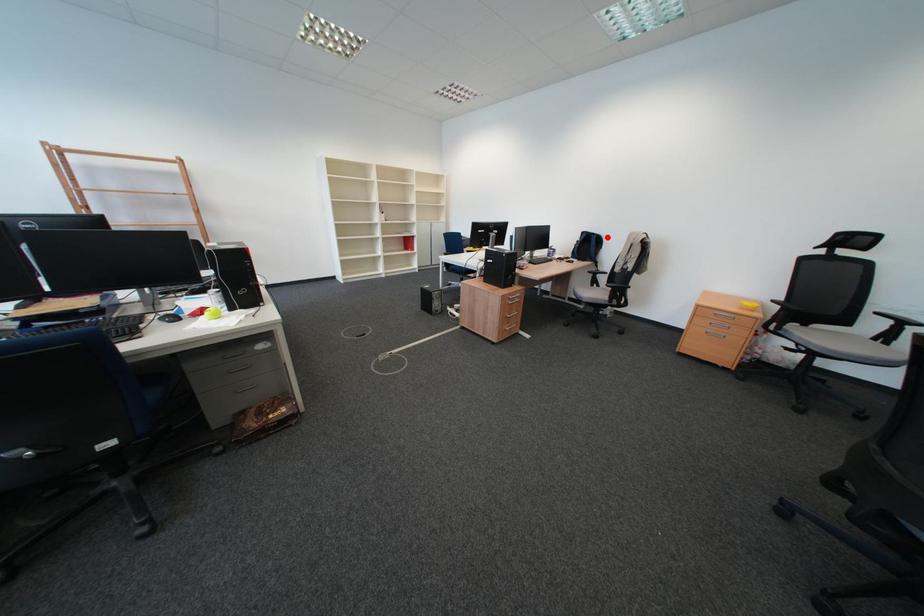
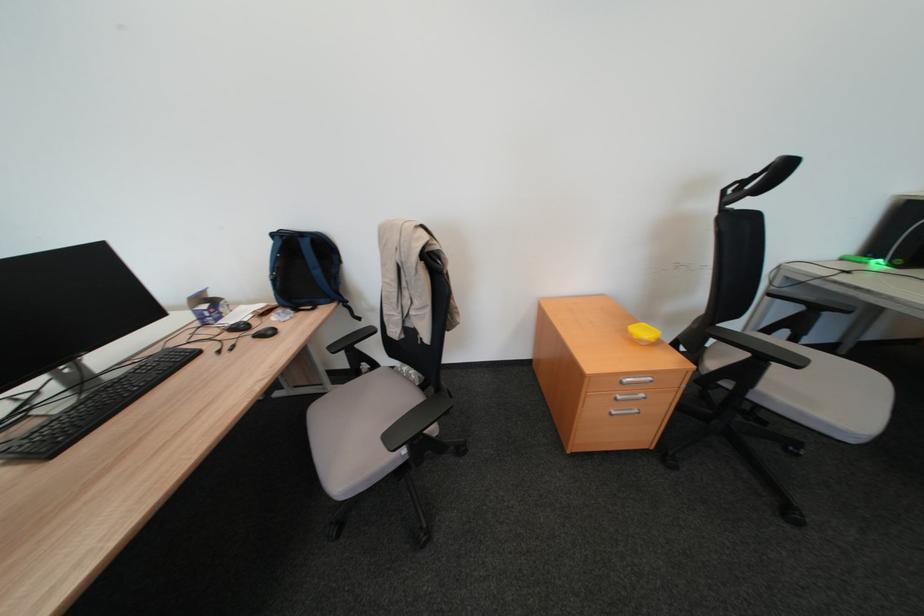
Locate, in the second image, the point that corresponds to the highlighted location in the first image.

(320, 241)